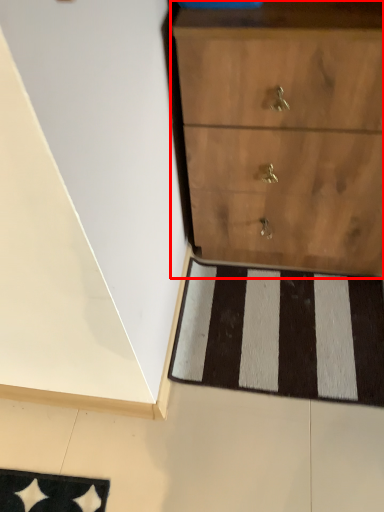
Question: Observing the image, what is the correct spatial positioning of chest of drawers (annotated by the red box) in reference to doormat?

Choices:
 (A) right
 (B) left

Answer: (A)